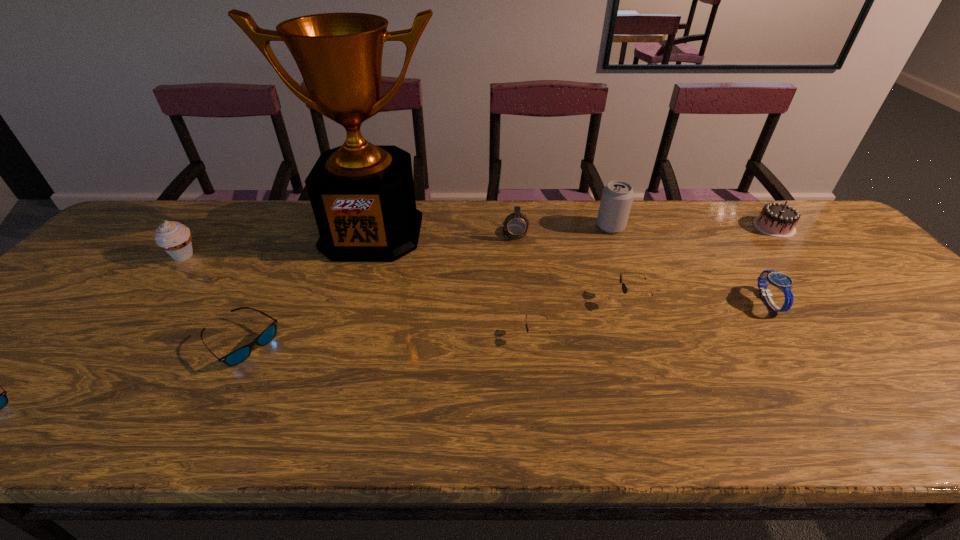
I want to click on the tallest object, so click(362, 195).

The image size is (960, 540). In order to click on trophy cup in this screenshot , I will do `click(362, 195)`.

Locate an element on the screen. can is located at coordinates (617, 196).

I want to click on muffin, so click(173, 237).

Find the location of a particular element. compass is located at coordinates (516, 224).

Locate an element on the screen. The width and height of the screenshot is (960, 540). the fifth tallest object is located at coordinates (778, 220).

The height and width of the screenshot is (540, 960). What are the coordinates of `chocolate cake` in the screenshot? It's located at (778, 220).

Find the location of a particular element. The height and width of the screenshot is (540, 960). the right black sunglasses is located at coordinates (624, 288).

Where is `the bigger black sunglasses`? the bigger black sunglasses is located at coordinates (624, 288).

Locate an element on the screen. blue watch is located at coordinates (782, 281).